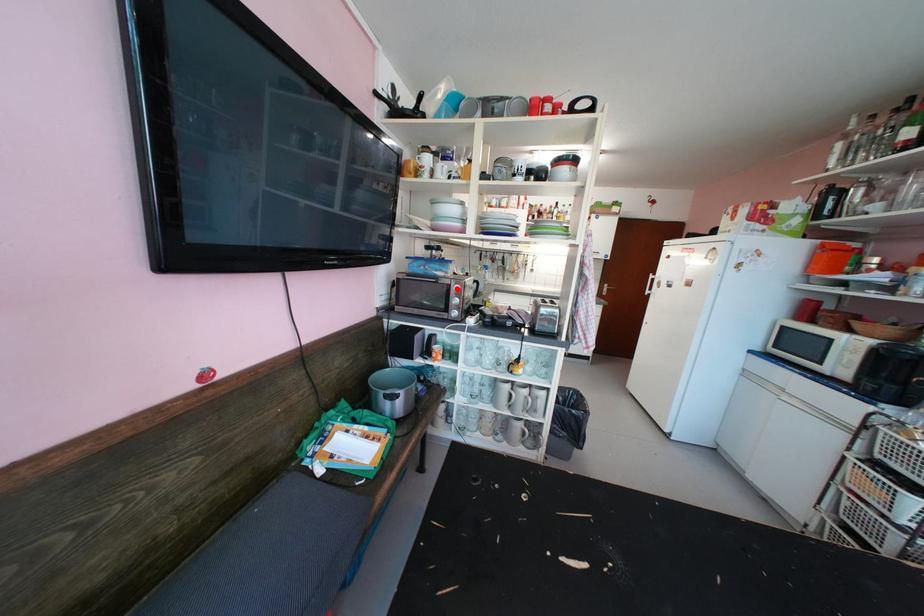
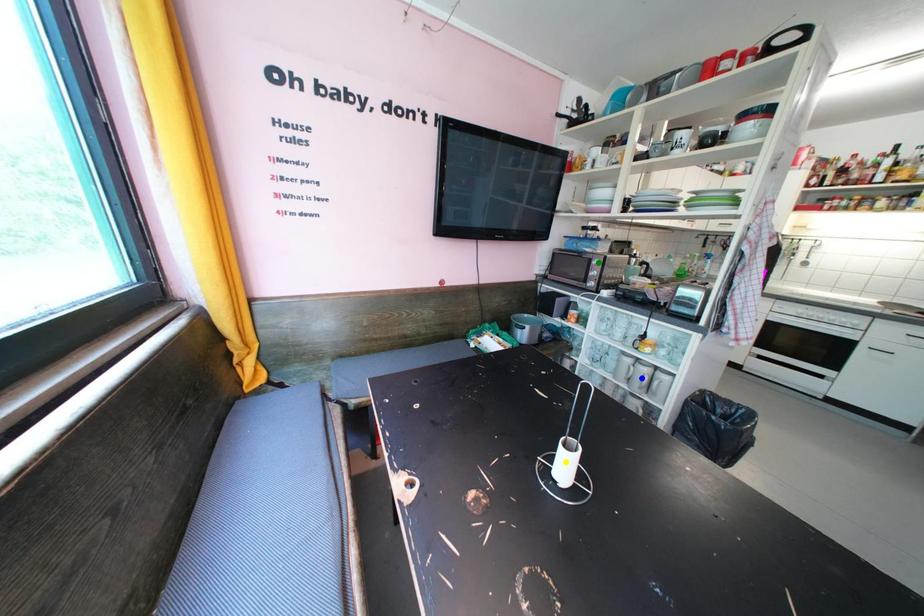
Question: I am providing you with two images of the same scene from different viewpoints. A red point is marked on the first image. You are given multiple points on the second image. Can you choose the point in image 2 that corresponds to the point in image 1?

Choices:
 (A) yellow point
 (B) green point
 (C) blue point

Answer: (B)